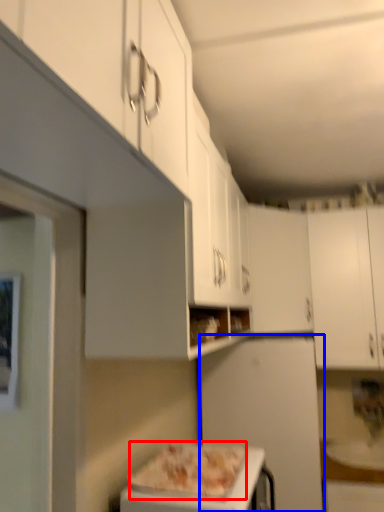
Question: Which object is closer to the camera taking this photo, pizza (highlighted by a red box) or appliance (highlighted by a blue box)?

Choices:
 (A) pizza
 (B) appliance

Answer: (A)